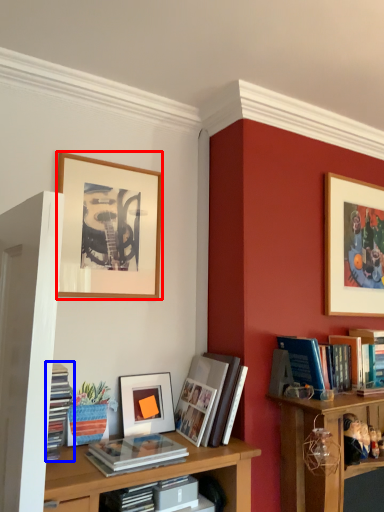
Question: Which object appears closest to the camera in this image, picture frame (highlighted by a red box) or book (highlighted by a blue box)?

Choices:
 (A) picture frame
 (B) book

Answer: (B)